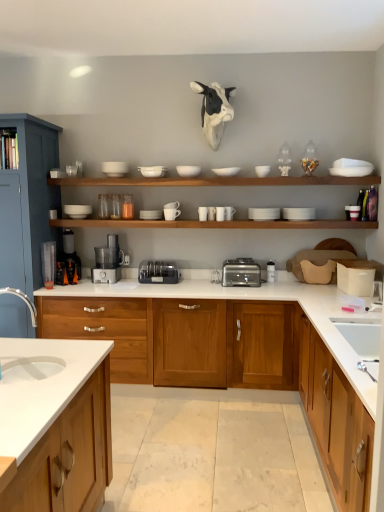
Question: Could you tell me if white matte cup at center, the seventh tableware in the left-to-right sequence, is turned towards white matte bowl at upper center, which ranks as the ninth tableware in left-to-right order?

Choices:
 (A) no
 (B) yes

Answer: (A)

Question: Is white matte cup at center, the seventh tableware in the left-to-right sequence, with white matte bowl at upper center, which is counted as the sixth tableware, starting from the right?

Choices:
 (A) yes
 (B) no

Answer: (B)

Question: Is there a large distance between white matte cup at center, the seventh tableware in the left-to-right sequence, and white matte bowl at upper center, which is counted as the sixth tableware, starting from the right?

Choices:
 (A) yes
 (B) no

Answer: (B)

Question: From a real-world perspective, is white matte cup at center, the 8th tableware when ordered from right to left, below white matte bowl at upper center, which is counted as the sixth tableware, starting from the right?

Choices:
 (A) no
 (B) yes

Answer: (B)

Question: Can you confirm if white matte cup at center, the 8th tableware when ordered from right to left, is wider than white matte bowl at upper center, which ranks as the ninth tableware in left-to-right order?

Choices:
 (A) yes
 (B) no

Answer: (B)

Question: Does white matte cup at center, the seventh tableware in the left-to-right sequence, have a lesser width compared to white matte bowl at upper center, which is counted as the sixth tableware, starting from the right?

Choices:
 (A) yes
 (B) no

Answer: (A)

Question: Can you confirm if white matte cup at center, placed as the 8th tableware when sorted from left to right, is positioned to the right of black plastic coffee machine at lower left, which is the second coffee machine in right-to-left order?

Choices:
 (A) no
 (B) yes

Answer: (B)

Question: Is white matte cup at center, placed as the 8th tableware when sorted from left to right, touching black plastic coffee machine at lower left, which is the first coffee machine in left-to-right order?

Choices:
 (A) no
 (B) yes

Answer: (A)

Question: Would you say white matte cup at center, which is counted as the seventh tableware, starting from the right, is a long distance from black plastic coffee machine at lower left, which is the second coffee machine in right-to-left order?

Choices:
 (A) yes
 (B) no

Answer: (A)

Question: Is black plastic coffee machine at lower left, which is the second coffee machine in right-to-left order, inside white matte cup at center, placed as the 8th tableware when sorted from left to right?

Choices:
 (A) no
 (B) yes

Answer: (A)

Question: Can you confirm if white matte cup at center, which is counted as the seventh tableware, starting from the right, is smaller than black plastic coffee machine at lower left, which is the second coffee machine in right-to-left order?

Choices:
 (A) no
 (B) yes

Answer: (B)

Question: From the image's perspective, is white matte cup at center, which is counted as the seventh tableware, starting from the right, on top of black plastic coffee machine at lower left, which is the second coffee machine in right-to-left order?

Choices:
 (A) yes
 (B) no

Answer: (A)

Question: From the image's perspective, would you say white matte bowl at upper center, the fifth tableware when ordered from left to right, is positioned over white matte bowl at upper center, the eleventh tableware when ordered from right to left?

Choices:
 (A) no
 (B) yes

Answer: (B)